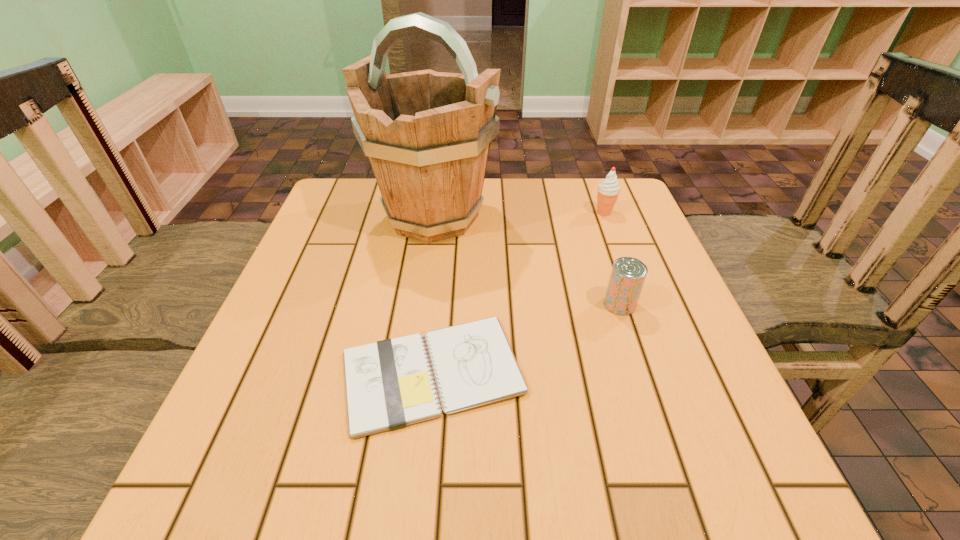
The width and height of the screenshot is (960, 540). I want to click on free space between the bucket and the nearest object, so click(x=433, y=294).

Locate an element on the screen. The width and height of the screenshot is (960, 540). free space between the third tallest object and the tallest object is located at coordinates (526, 260).

Locate an element on the screen. free space between the tallest object and the third farthest object is located at coordinates (526, 260).

Point out which object is positioned as the nearest to the nearest object. Please provide its 2D coordinates. Your answer should be formatted as a tuple, i.e. [(x, y)], where the tuple contains the x and y coordinates of a point satisfying the conditions above.

[(628, 274)]

The height and width of the screenshot is (540, 960). In order to click on object that can be found as the second closest to the second tallest object in this screenshot , I will do 628,274.

The image size is (960, 540). What are the coordinates of `vacant space that satisfies the following two spatial constraints: 1. on the back side of the notepad; 2. on the left side of the icecream` in the screenshot? It's located at (448, 212).

I want to click on vacant space that satisfies the following two spatial constraints: 1. on the front side of the bucket; 2. on the right side of the nearest object, so click(411, 373).

In order to click on blank space that satisfies the following two spatial constraints: 1. on the back side of the notepad; 2. on the right side of the icecream in this screenshot , I will do click(448, 212).